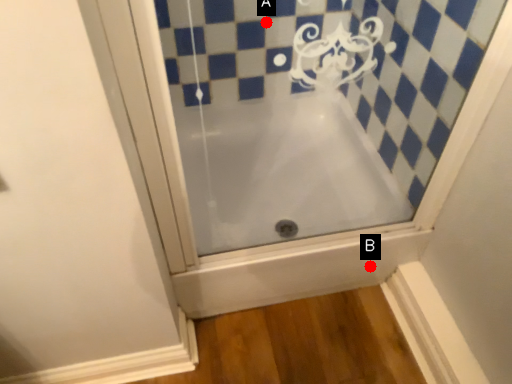
Question: Two points are circled on the image, labeled by A and B beside each circle. Which of the following is the farthest from the observer?

Choices:
 (A) A is further
 (B) B is further

Answer: (A)